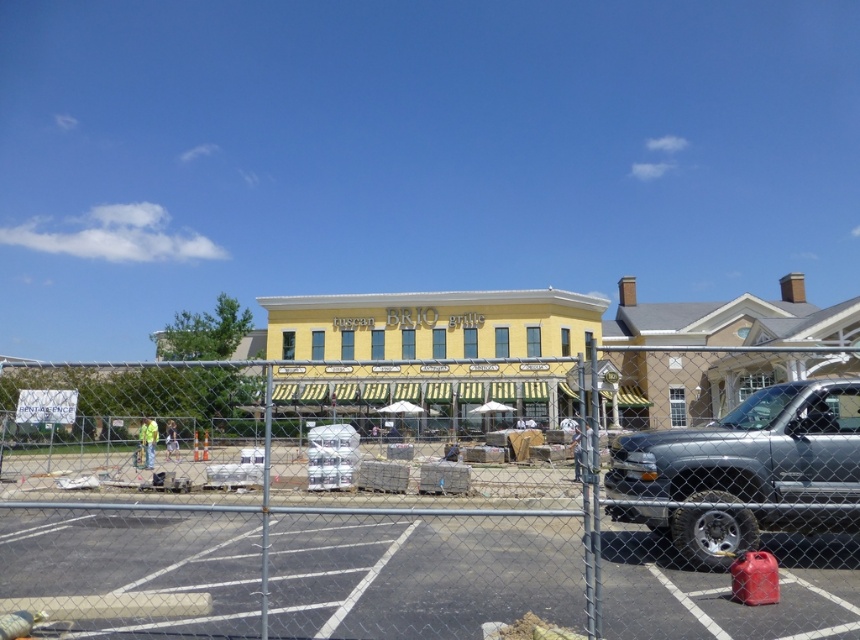
Looking at this image, you are a delivery driver who needs to unload a package that requires a 20 meter clearance area. You arrive at the construction site and see the chain link fence at center and the silver metallic pickup truck at right. Can you determine if the space between them is sufficient for your clearance requirement?

The distance between the chain link fence at center and the silver metallic pickup truck at right is 21.33 meters, which is more than the required 20 meter clearance area. Therefore, the space is sufficient for your needs.

You are standing in front of the construction site at BRIO grille. There is a point marked at coordinates (422,509). What object is located at that point?

The point at coordinates (422,509) indicates the chain link fence at center.